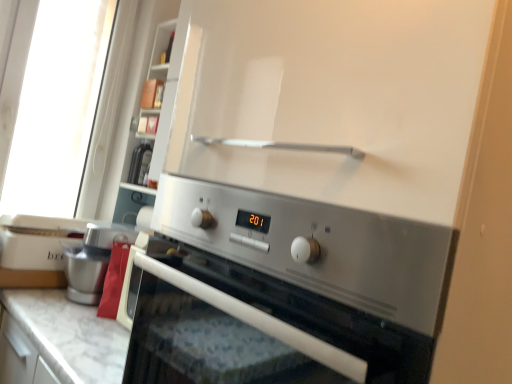
In order to face metallic silver coffee machine at left, should I rotate leftwards or rightwards?

A 20.039 degree turn to the left will do.

Locate an element on the screen. The image size is (512, 384). white plastic toaster at left is located at coordinates (36, 250).

The image size is (512, 384). In order to click on white marble countertop at lower center in this screenshot , I will do `click(72, 334)`.

What's the angular difference between white plastic toaster at left and satin silver oven at center's facing directions?

1.58 degrees.

Is white plastic toaster at left wider or thinner than satin silver oven at center?

In the image, white plastic toaster at left appears to be more narrow than satin silver oven at center.

Between white plastic toaster at left and satin silver oven at center, which one has more height?

satin silver oven at center.

From the image's perspective, which object appears higher, white plastic toaster at left or satin silver oven at center?

white plastic toaster at left is shown above in the image.

From a real-world perspective, between metallic silver coffee machine at left and satin silver oven at center, who is vertically higher?

satin silver oven at center is physically above.

Is the depth of metallic silver coffee machine at left greater than that of satin silver oven at center?

Yes, metallic silver coffee machine at left is further from the viewer.

Is metallic silver coffee machine at left to the left of satin silver oven at center from the viewer's perspective?

Correct, you'll find metallic silver coffee machine at left to the left of satin silver oven at center.

Choose the correct answer: Is metallic silver coffee machine at left inside satin silver oven at center or outside it?

metallic silver coffee machine at left is spatially situated outside satin silver oven at center.

Is metallic silver coffee machine at left to the left of white plastic toaster at left from the viewer's perspective?

In fact, metallic silver coffee machine at left is to the right of white plastic toaster at left.

From the image's perspective, does metallic silver coffee machine at left appear lower than white plastic toaster at left?

Yes, from the image's perspective, metallic silver coffee machine at left is beneath white plastic toaster at left.

Considering the sizes of objects metallic silver coffee machine at left and white plastic toaster at left in the image provided, who is thinner, metallic silver coffee machine at left or white plastic toaster at left?

metallic silver coffee machine at left is thinner.

Between point (100, 256) and point (10, 235), which one is positioned behind?

The point (10, 235) is farther from the camera.

Is white marble countertop at lower center at the right side of metallic silver coffee machine at left?

Yes.

Consider the image. Which of these two, white marble countertop at lower center or metallic silver coffee machine at left, is thinner?

metallic silver coffee machine at left is thinner.

Based on the photo, is white marble countertop at lower center aimed at metallic silver coffee machine at left?

No, white marble countertop at lower center is not oriented towards metallic silver coffee machine at left.

From a real-world perspective, who is located higher, white marble countertop at lower center or metallic silver coffee machine at left?

From a 3D spatial view, metallic silver coffee machine at left is above.

Considering the relative sizes of white marble countertop at lower center and white plastic toaster at left in the image provided, is white marble countertop at lower center thinner than white plastic toaster at left?

In fact, white marble countertop at lower center might be wider than white plastic toaster at left.

Is white marble countertop at lower center in contact with white plastic toaster at left?

No, white marble countertop at lower center is not making contact with white plastic toaster at left.

Can you confirm if white marble countertop at lower center is taller than white plastic toaster at left?

Yes.

Is white marble countertop at lower center situated inside white plastic toaster at left or outside?

white marble countertop at lower center is located beyond the bounds of white plastic toaster at left.

Is satin silver oven at center not close to white plastic toaster at left?

Yes.

From the picture: From a real-world perspective, is satin silver oven at center on white plastic toaster at left?

Yes, from a real-world perspective, satin silver oven at center is over white plastic toaster at left

Where is `appliance behind the satin silver oven at center`? appliance behind the satin silver oven at center is located at coordinates tap(36, 250).

Considering the sizes of objects satin silver oven at center and white plastic toaster at left in the image provided, who is bigger, satin silver oven at center or white plastic toaster at left?

With larger size is satin silver oven at center.

I want to click on coffee machine above the satin silver oven at center (from the image's perspective), so click(x=93, y=260).

Is satin silver oven at center in front of or behind metallic silver coffee machine at left in the image?

satin silver oven at center is positioned closer to the viewer than metallic silver coffee machine at left.

Considering the positions of points (151, 360) and (122, 232), is point (151, 360) farther from camera compared to point (122, 232)?

No, it is not.

The image size is (512, 384). I want to click on appliance that appears below the satin silver oven at center (from a real-world perspective), so click(36, 250).

The width and height of the screenshot is (512, 384). I want to click on coffee machine behind the satin silver oven at center, so pyautogui.click(x=93, y=260).

Looking at the image, which one is located further to metallic silver coffee machine at left, white plastic toaster at left or white marble countertop at lower center?

white marble countertop at lower center lies further to metallic silver coffee machine at left than the other object.

Looking at the image, which one is located further to white plastic toaster at left, metallic silver coffee machine at left or satin silver oven at center?

satin silver oven at center is positioned further to the anchor white plastic toaster at left.

Estimate the real-world distances between objects in this image. Which object is closer to white plastic toaster at left, satin silver oven at center or metallic silver coffee machine at left?

Based on the image, metallic silver coffee machine at left appears to be nearer to white plastic toaster at left.

Which object lies nearer to the anchor point satin silver oven at center, white plastic toaster at left or white marble countertop at lower center?

white marble countertop at lower center is closer to satin silver oven at center.

Looking at the image, which one is located further to white plastic toaster at left, white marble countertop at lower center or metallic silver coffee machine at left?

Based on the image, white marble countertop at lower center appears to be further to white plastic toaster at left.

Estimate the real-world distances between objects in this image. Which object is further from white marble countertop at lower center, metallic silver coffee machine at left or white plastic toaster at left?

Based on the image, white plastic toaster at left appears to be further to white marble countertop at lower center.

Considering their positions, is white marble countertop at lower center positioned closer to satin silver oven at center than metallic silver coffee machine at left?

white marble countertop at lower center is closer to satin silver oven at center.

Which object lies further to the anchor point satin silver oven at center, metallic silver coffee machine at left or white marble countertop at lower center?

The object further to satin silver oven at center is metallic silver coffee machine at left.

Identify the location of coffee machine located between white marble countertop at lower center and white plastic toaster at left in the depth direction. (93, 260).

This screenshot has width=512, height=384. What are the coordinates of `countertop located between satin silver oven at center and white plastic toaster at left in the depth direction` in the screenshot? It's located at (72, 334).

I want to click on coffee machine between satin silver oven at center and white plastic toaster at left along the z-axis, so click(x=93, y=260).

Identify the location of countertop between satin silver oven at center and metallic silver coffee machine at left along the z-axis. click(x=72, y=334).